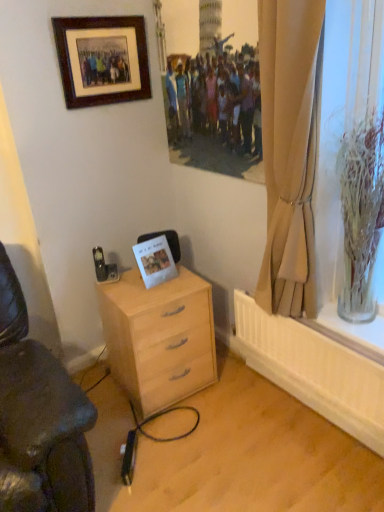
Question: Does beige fabric curtain at right have a lesser height compared to white paper postcard at center?

Choices:
 (A) no
 (B) yes

Answer: (A)

Question: Considering the relative sizes of beige fabric curtain at right and white paper postcard at center in the image provided, is beige fabric curtain at right bigger than white paper postcard at center?

Choices:
 (A) yes
 (B) no

Answer: (A)

Question: Does beige fabric curtain at right turn towards white paper postcard at center?

Choices:
 (A) no
 (B) yes

Answer: (A)

Question: Does beige fabric curtain at right appear on the right side of white paper postcard at center?

Choices:
 (A) no
 (B) yes

Answer: (B)

Question: From a real-world perspective, is beige fabric curtain at right positioned over white paper postcard at center based on gravity?

Choices:
 (A) yes
 (B) no

Answer: (A)

Question: Is point (97, 68) positioned closer to the camera than point (144, 245)?

Choices:
 (A) farther
 (B) closer

Answer: (B)

Question: In the image, is wooden picture frame at upper left on the left side or the right side of white paper postcard at center?

Choices:
 (A) right
 (B) left

Answer: (B)

Question: From the image's perspective, is wooden picture frame at upper left positioned above or below white paper postcard at center?

Choices:
 (A) above
 (B) below

Answer: (A)

Question: Which is correct: wooden picture frame at upper left is inside white paper postcard at center, or outside of it?

Choices:
 (A) inside
 (B) outside

Answer: (B)

Question: From a real-world perspective, is light wood/finish desk at lower center positioned above or below clear glass vase at right?

Choices:
 (A) above
 (B) below

Answer: (B)

Question: Would you say light wood/finish desk at lower center is inside or outside clear glass vase at right?

Choices:
 (A) outside
 (B) inside

Answer: (A)

Question: In the image, is light wood/finish desk at lower center positioned in front of or behind clear glass vase at right?

Choices:
 (A) behind
 (B) front

Answer: (A)

Question: In terms of width, does light wood/finish desk at lower center look wider or thinner when compared to clear glass vase at right?

Choices:
 (A) wide
 (B) thin

Answer: (A)

Question: Is point (157, 236) positioned closer to the camera than point (370, 317)?

Choices:
 (A) farther
 (B) closer

Answer: (A)

Question: Considering the positions of white paper postcard at center and clear glass vase at right in the image, is white paper postcard at center wider or thinner than clear glass vase at right?

Choices:
 (A) wide
 (B) thin

Answer: (B)